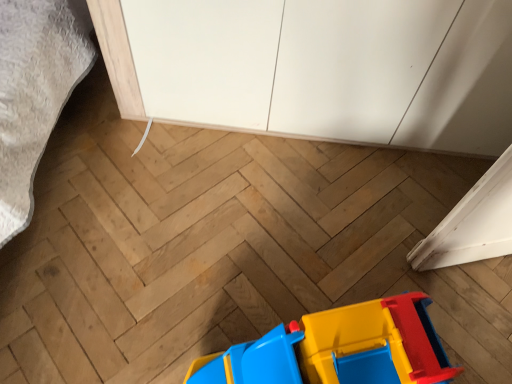
Question: From a real-world perspective, is matte plastic toy at lower center on top of white matte cabinet at upper center?

Choices:
 (A) yes
 (B) no

Answer: (B)

Question: Considering the relative sizes of matte plastic toy at lower center and white matte cabinet at upper center in the image provided, is matte plastic toy at lower center wider than white matte cabinet at upper center?

Choices:
 (A) yes
 (B) no

Answer: (B)

Question: Are matte plastic toy at lower center and white matte cabinet at upper center making contact?

Choices:
 (A) no
 (B) yes

Answer: (A)

Question: Considering the relative positions of matte plastic toy at lower center and white matte cabinet at upper center in the image provided, is matte plastic toy at lower center to the left of white matte cabinet at upper center from the viewer's perspective?

Choices:
 (A) yes
 (B) no

Answer: (A)

Question: Does matte plastic toy at lower center appear on the right side of white matte cabinet at upper center?

Choices:
 (A) yes
 (B) no

Answer: (B)

Question: Is matte plastic toy at lower center facing away from white matte cabinet at upper center?

Choices:
 (A) no
 (B) yes

Answer: (B)

Question: From a real-world perspective, is white matte cabinet at upper center on matte plastic toy at lower center?

Choices:
 (A) no
 (B) yes

Answer: (B)

Question: Could you tell me if white matte cabinet at upper center is turned towards matte plastic toy at lower center?

Choices:
 (A) no
 (B) yes

Answer: (B)

Question: Is white matte cabinet at upper center not near matte plastic toy at lower center?

Choices:
 (A) yes
 (B) no

Answer: (B)

Question: Considering the relative positions of white matte cabinet at upper center and matte plastic toy at lower center in the image provided, is white matte cabinet at upper center to the left of matte plastic toy at lower center from the viewer's perspective?

Choices:
 (A) yes
 (B) no

Answer: (B)

Question: Are white matte cabinet at upper center and matte plastic toy at lower center making contact?

Choices:
 (A) yes
 (B) no

Answer: (B)

Question: Is matte plastic toy at lower center at the back of white matte cabinet at upper center?

Choices:
 (A) no
 (B) yes

Answer: (A)

Question: Looking at their shapes, would you say white matte cabinet at upper center is wider or thinner than matte plastic toy at lower center?

Choices:
 (A) thin
 (B) wide

Answer: (B)